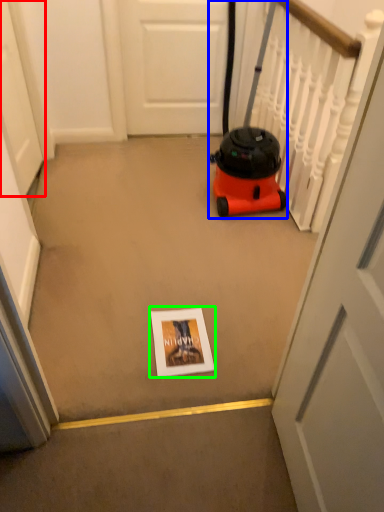
Question: Which is nearer to the door (highlighted by a red box)? equipment (highlighted by a blue box) or copy (highlighted by a green box).

Choices:
 (A) equipment
 (B) copy

Answer: (A)